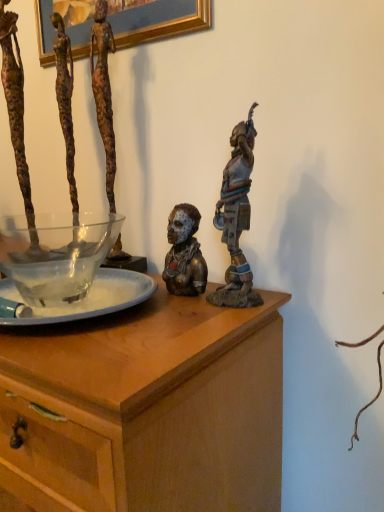
Locate an element on the screen. vacant area on top of translucent glass bowl at center (from a real-world perspective) is located at coordinates (51, 279).